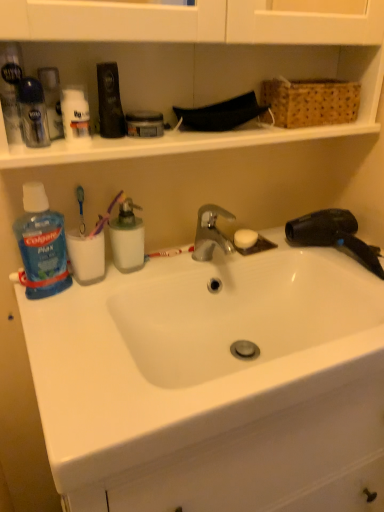
Question: From a real-world perspective, does woven brown basket at upper right sit lower than white plastic toothbrush at center?

Choices:
 (A) yes
 (B) no

Answer: (B)

Question: Are woven brown basket at upper right and white plastic toothbrush at center making contact?

Choices:
 (A) no
 (B) yes

Answer: (A)

Question: Considering the relative sizes of woven brown basket at upper right and white plastic toothbrush at center in the image provided, is woven brown basket at upper right thinner than white plastic toothbrush at center?

Choices:
 (A) yes
 (B) no

Answer: (B)

Question: Does woven brown basket at upper right have a smaller size compared to white plastic toothbrush at center?

Choices:
 (A) no
 (B) yes

Answer: (A)

Question: Considering the relative positions of woven brown basket at upper right and white plastic toothbrush at center in the image provided, is woven brown basket at upper right to the right of white plastic toothbrush at center from the viewer's perspective?

Choices:
 (A) no
 (B) yes

Answer: (B)

Question: Is woven brown basket at upper right not inside white plastic toothbrush at center?

Choices:
 (A) no
 (B) yes

Answer: (B)

Question: Is translucent plastic container at center, positioned as the second cleaning product in left-to-right order, oriented towards white ceramic sink at center?

Choices:
 (A) no
 (B) yes

Answer: (A)

Question: From the image's perspective, is translucent plastic container at center, positioned as the second cleaning product in left-to-right order, below white ceramic sink at center?

Choices:
 (A) yes
 (B) no

Answer: (B)

Question: Is translucent plastic container at center, positioned as the second cleaning product in left-to-right order, bigger than white ceramic sink at center?

Choices:
 (A) no
 (B) yes

Answer: (A)

Question: Is translucent plastic container at center, acting as the 1th cleaning product starting from the right, beside white ceramic sink at center?

Choices:
 (A) no
 (B) yes

Answer: (A)

Question: Is white ceramic sink at center a part of translucent plastic container at center, acting as the 1th cleaning product starting from the right?

Choices:
 (A) no
 (B) yes

Answer: (A)

Question: Would you consider translucent plastic container at center, positioned as the second cleaning product in left-to-right order, to be distant from white ceramic sink at center?

Choices:
 (A) no
 (B) yes

Answer: (A)

Question: From the image's perspective, is white ceramic sink at center located above translucent plastic container at center, acting as the 1th cleaning product starting from the right?

Choices:
 (A) no
 (B) yes

Answer: (A)